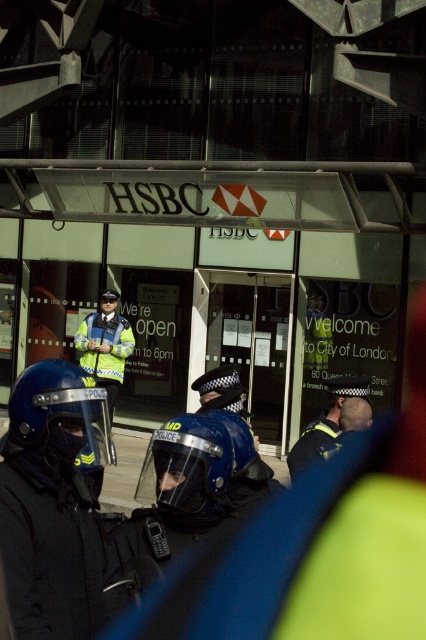
Question: Which of the following is the farthest from the observer?

Choices:
 (A) matte blue helmet at center
 (B) reflective blue helmet at center
 (C) blue hardshell helmet at center
 (D) high visibility jacket at center

Answer: (D)

Question: Where is matte blue helmet at center located in relation to reflective blue helmet at center in the image?

Choices:
 (A) above
 (B) below

Answer: (A)

Question: Does blue matte helmet at center appear over reflective blue helmet at center?

Choices:
 (A) yes
 (B) no

Answer: (A)

Question: Which object appears closest to the camera in this image?

Choices:
 (A) blue hardshell helmet at center
 (B) high visibility jacket at center
 (C) blue matte helmet at center
 (D) reflective blue helmet at center

Answer: (C)

Question: Is matte blue helmet at center smaller than reflective blue helmet at center?

Choices:
 (A) no
 (B) yes

Answer: (B)

Question: Which of the following is the closest to the observer?

Choices:
 (A) reflective blue helmet at center
 (B) blue matte helmet at center

Answer: (B)